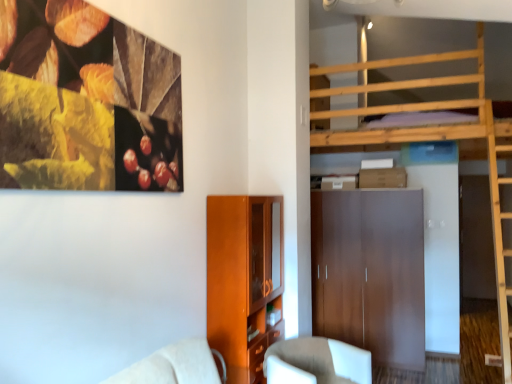
Question: From the image's perspective, is matte wood cabinet at lower center on top of white fabric chair at lower center?

Choices:
 (A) yes
 (B) no

Answer: (A)

Question: Considering the relative positions of matte wood cabinet at lower center and white fabric chair at lower center in the image provided, is matte wood cabinet at lower center to the left of white fabric chair at lower center from the viewer's perspective?

Choices:
 (A) yes
 (B) no

Answer: (A)

Question: Considering the relative sizes of matte wood cabinet at lower center and white fabric chair at lower center in the image provided, is matte wood cabinet at lower center shorter than white fabric chair at lower center?

Choices:
 (A) yes
 (B) no

Answer: (B)

Question: From the image's perspective, is matte wood cabinet at lower center located beneath white fabric chair at lower center?

Choices:
 (A) no
 (B) yes

Answer: (A)

Question: Is matte wood cabinet at lower center facing away from white fabric chair at lower center?

Choices:
 (A) no
 (B) yes

Answer: (B)

Question: Does matte wood cabinet at lower center have a lesser width compared to white fabric chair at lower center?

Choices:
 (A) no
 (B) yes

Answer: (B)

Question: Is white fabric chair at lower center positioned in front of matte brown wardrobe at center?

Choices:
 (A) yes
 (B) no

Answer: (A)

Question: Is matte brown wardrobe at center completely or partially inside white fabric chair at lower center?

Choices:
 (A) yes
 (B) no

Answer: (B)

Question: Is white fabric chair at lower center outside of matte brown wardrobe at center?

Choices:
 (A) no
 (B) yes

Answer: (B)

Question: From the image's perspective, is white fabric chair at lower center on matte brown wardrobe at center?

Choices:
 (A) no
 (B) yes

Answer: (A)

Question: Can you confirm if white fabric chair at lower center is bigger than matte brown wardrobe at center?

Choices:
 (A) yes
 (B) no

Answer: (B)

Question: From a real-world perspective, does white fabric chair at lower center sit lower than matte brown wardrobe at center?

Choices:
 (A) no
 (B) yes

Answer: (B)

Question: Can you see matte brown wardrobe at center touching matte wood cabinet at lower center?

Choices:
 (A) no
 (B) yes

Answer: (A)